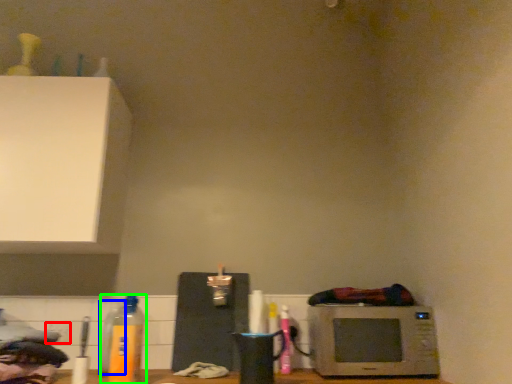
Question: Which is nearer to the electric outlet (highlighted by a red box)? bottle (highlighted by a blue box) or bottle (highlighted by a green box).

Choices:
 (A) bottle
 (B) bottle

Answer: (A)